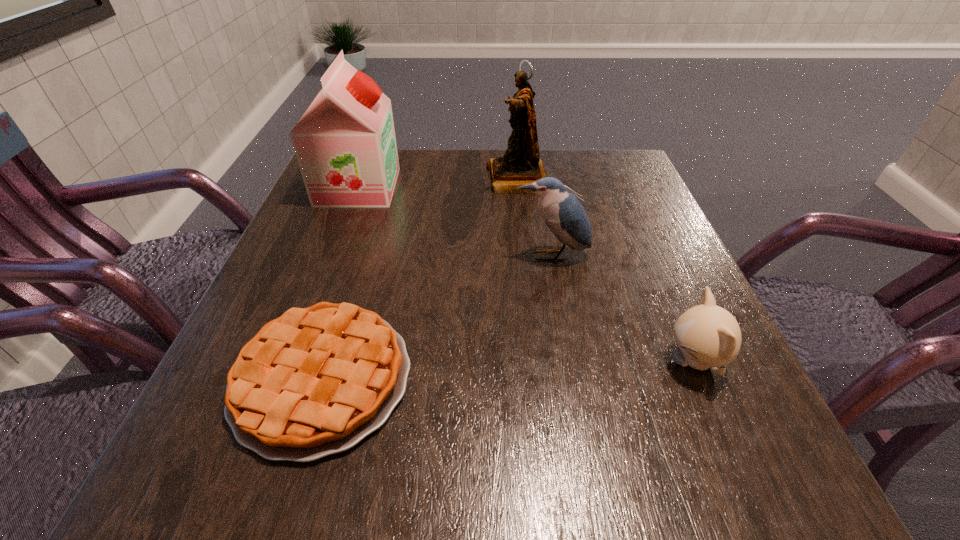
The width and height of the screenshot is (960, 540). I want to click on blank area in the image that satisfies the following two spatial constraints: 1. on the front-facing side of the figurine; 2. on the front side of the shortest object, so click(540, 379).

Where is `vacant region that satisfies the following two spatial constraints: 1. with the cap open on the soya milk; 2. on the right side of the pie`? vacant region that satisfies the following two spatial constraints: 1. with the cap open on the soya milk; 2. on the right side of the pie is located at coordinates (285, 379).

Identify the location of vacant area in the image that satisfies the following two spatial constraints: 1. on the front-facing side of the figurine; 2. on the front side of the shortest object. This screenshot has width=960, height=540. (540, 379).

You are a GUI agent. You are given a task and a screenshot of the screen. Output one action in this format:
    pyautogui.click(x=<x>, y=<y>)
    Task: Click on the free location that satisfies the following two spatial constraints: 1. with the cap open on the soya milk; 2. on the left side of the shortest object
    This screenshot has width=960, height=540.
    Given the screenshot: What is the action you would take?
    [285, 379]